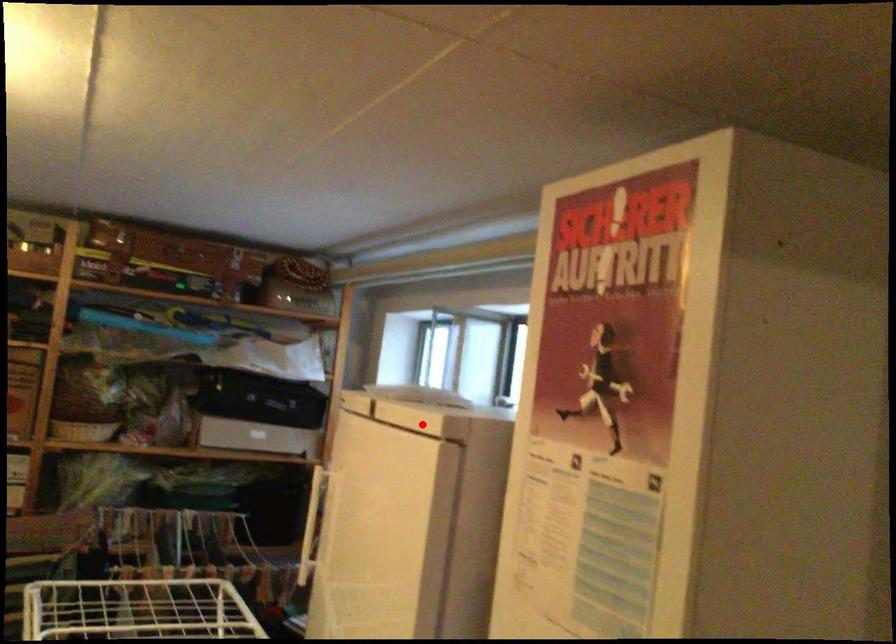
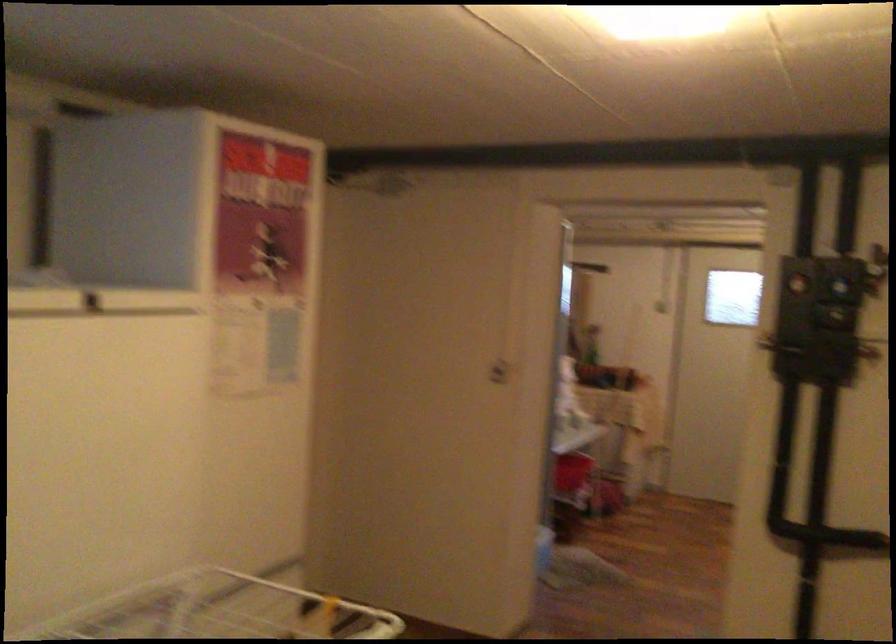
Where in the second image is the point corresponding to the highlighted location from the first image?

(99, 301)